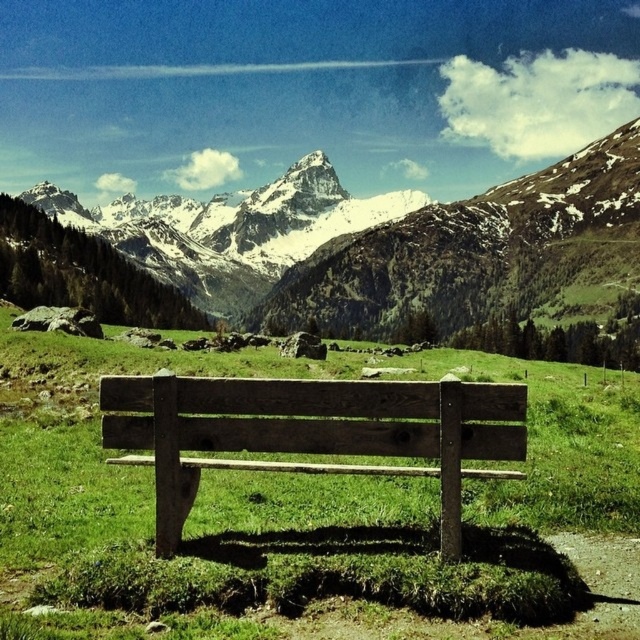
This screenshot has width=640, height=640. Identify the location of snowy granite mountain range at upper center. (371, 243).

Who is more distant from viewer, (342, 324) or (147, 445)?

Positioned behind is point (342, 324).

The height and width of the screenshot is (640, 640). Identify the location of snowy granite mountain range at upper center. (371, 243).